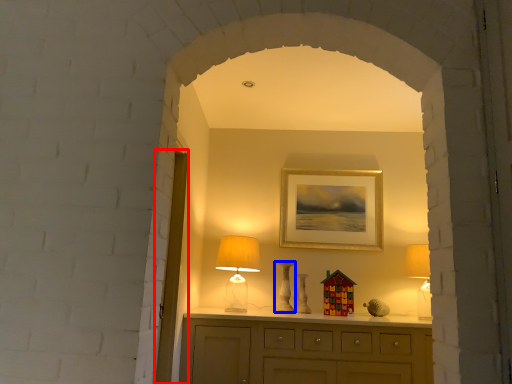
Question: Which of the following is the closest to the observer, glass door (highlighted by a red box) or vase (highlighted by a blue box)?

Choices:
 (A) glass door
 (B) vase

Answer: (A)